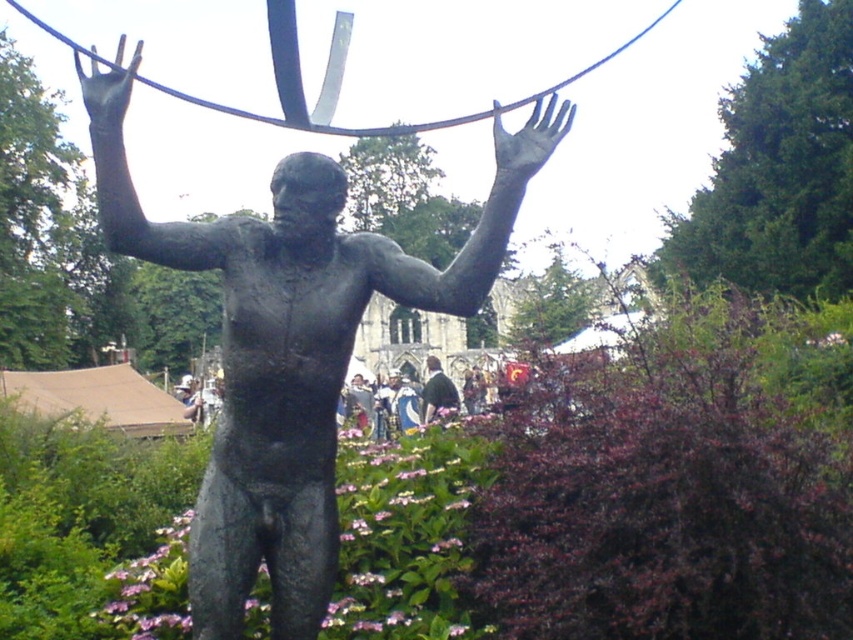
Does bronze statue at center have a greater width compared to bronze metallic hand at upper center?

Yes.

Is the position of bronze statue at center more distant than that of bronze metallic hand at upper center?

No, it is not.

Which is in front, point (262, 264) or point (526, 170)?

Point (526, 170)

Identify the location of bronze statue at center. The width and height of the screenshot is (853, 640). (285, 369).

Looking at this image, who is higher up, bronze hand at upper center or dark brown leather jacket at center?

bronze hand at upper center is higher up.

Which of these two, bronze hand at upper center or dark brown leather jacket at center, stands shorter?

With less height is dark brown leather jacket at center.

Is point (120, 76) positioned before point (434, 384)?

Yes.

The width and height of the screenshot is (853, 640). I want to click on bronze hand at upper center, so click(x=107, y=88).

Does bronze metallic hand at upper center have a larger size compared to bronze hand at upper center?

Incorrect, bronze metallic hand at upper center is not larger than bronze hand at upper center.

Is bronze metallic hand at upper center taller than bronze hand at upper center?

No, bronze metallic hand at upper center is not taller than bronze hand at upper center.

Who is more forward, (x=503, y=147) or (x=115, y=88)?

Point (x=115, y=88)

You are a GUI agent. You are given a task and a screenshot of the screen. Output one action in this format:
    pyautogui.click(x=<x>, y=<y>)
    Task: Click on the bronze metallic hand at upper center
    
    Given the screenshot: What is the action you would take?
    pyautogui.click(x=529, y=140)